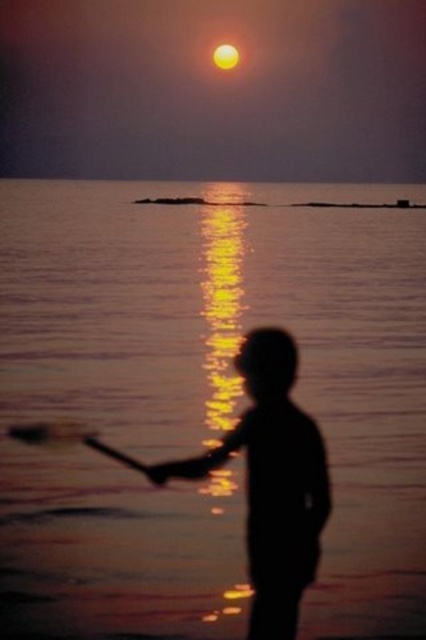
Question: Does smooth water at center have a greater width compared to silhouette figure at center?

Choices:
 (A) yes
 (B) no

Answer: (A)

Question: Which of the following is the closest to the observer?

Choices:
 (A) (282, 528)
 (B) (46, 317)

Answer: (A)

Question: Is smooth water at center bigger than silhouette figure at center?

Choices:
 (A) no
 (B) yes

Answer: (B)

Question: Which object appears farthest from the camera in this image?

Choices:
 (A) silhouette figure at center
 (B) smooth water at center

Answer: (B)

Question: Can you confirm if smooth water at center is positioned to the left of silhouette figure at center?

Choices:
 (A) yes
 (B) no

Answer: (B)